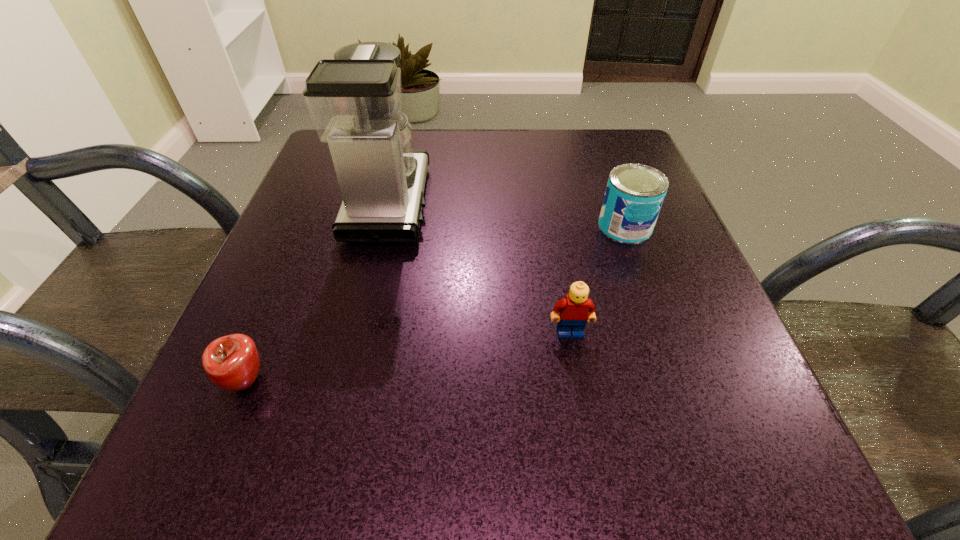
You are a GUI agent. You are given a task and a screenshot of the screen. Output one action in this format:
    pyautogui.click(x=<x>, y=<y>)
    Task: Click on the second object from left to right
    The height and width of the screenshot is (540, 960).
    Given the screenshot: What is the action you would take?
    pyautogui.click(x=355, y=100)

This screenshot has height=540, width=960. I want to click on coffee maker, so click(355, 100).

Find the location of `can`. can is located at coordinates (634, 195).

You are a GUI agent. You are given a task and a screenshot of the screen. Output one action in this format:
    pyautogui.click(x=<x>, y=<y>)
    Task: Click on the second object from right to left
    The height and width of the screenshot is (540, 960).
    Given the screenshot: What is the action you would take?
    pyautogui.click(x=576, y=308)

Where is `the third farthest object`? This screenshot has height=540, width=960. the third farthest object is located at coordinates (576, 308).

The width and height of the screenshot is (960, 540). I want to click on the nearest object, so click(231, 362).

Identify the location of the shortest object. (231, 362).

Identify the location of vacant space located 0.280m at the front of the second object from left to right where the controls are located. The image size is (960, 540). (567, 203).

Find the location of a particular element. vacant space situated on the left of the can is located at coordinates (562, 226).

At what (x,y) coordinates should I click in order to perform the action: click on vacant space located 0.120m on the front-facing side of the second object from right to left. Please return your answer as a coordinate pair (x, y). The width and height of the screenshot is (960, 540). Looking at the image, I should click on tap(585, 414).